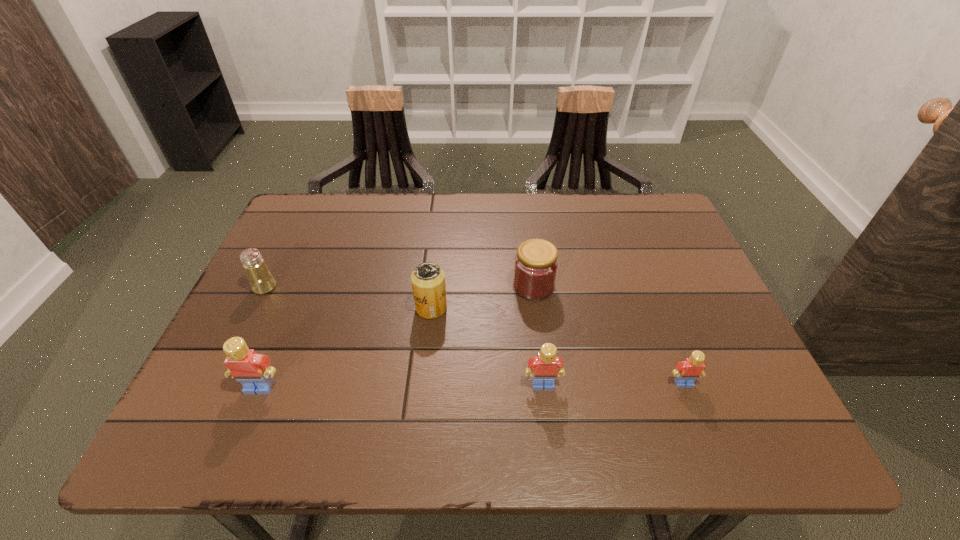
The height and width of the screenshot is (540, 960). What are the coordinates of `the tallest Lego` in the screenshot? It's located at (252, 370).

I want to click on the second object from left to right, so click(252, 370).

The height and width of the screenshot is (540, 960). Find the location of `the second tallest Lego`. the second tallest Lego is located at coordinates (544, 368).

At what (x,y) coordinates should I click in order to perform the action: click on the rightmost Lego. Please return your answer as a coordinate pair (x, y). Looking at the image, I should click on [687, 371].

Locate an element on the screen. The height and width of the screenshot is (540, 960). the shortest object is located at coordinates (687, 371).

Where is `jam`? jam is located at coordinates tap(536, 263).

Locate an element on the screen. the fourth object from right to left is located at coordinates (428, 280).

This screenshot has width=960, height=540. Find the location of `the leftmost object`. the leftmost object is located at coordinates (261, 280).

Where is `free space located 0.100m on the left of the jam`? free space located 0.100m on the left of the jam is located at coordinates (472, 286).

You are a GUI agent. You are given a task and a screenshot of the screen. Output one action in this format:
    pyautogui.click(x=<x>, y=<y>)
    Task: Click on the vacant space positioned 0.210m on the left of the beer can
    The height and width of the screenshot is (540, 960).
    Given the screenshot: What is the action you would take?
    pyautogui.click(x=327, y=308)